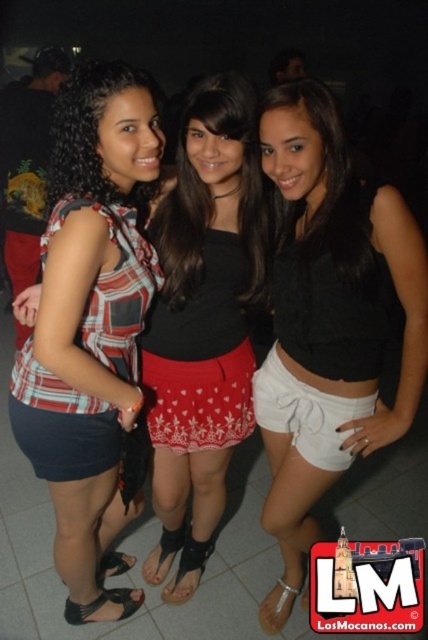
You are a photographer at the event and need to adjust the lighting to highlight the lower half of the black matte shorts at center and the red printed skirt at center. Which one is positioned lower on the person?

The black matte shorts at center is located below the red printed skirt at center, so it is positioned lower on the person.

You are a photographer trying to adjust the lighting for a photo shoot. You notice the plaid fabric top at center and the red printed skirt at center. Which item is located lower in the image?

The plaid fabric top at center is positioned under the red printed skirt at center, so it is located lower in the image.